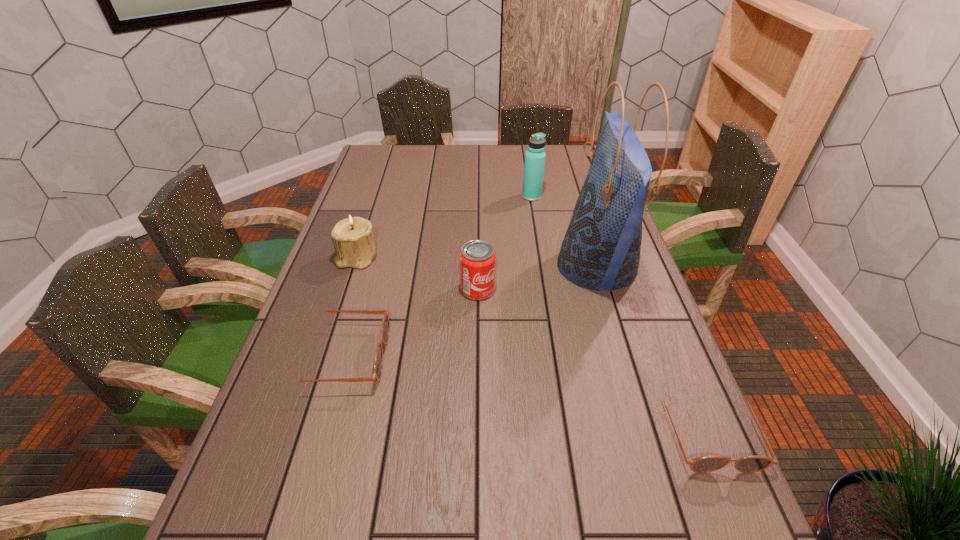
Please point a spot to place another sunglasses for symmetrical spacing. Please provide its 2D coordinates. Your answer should be formatted as a tuple, i.e. [(x, y)], where the tuple contains the x and y coordinates of a point satisfying the conditions above.

[(512, 391)]